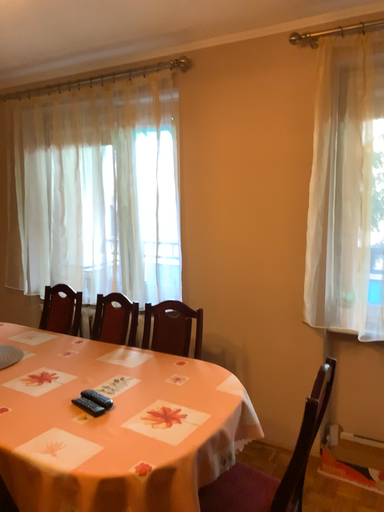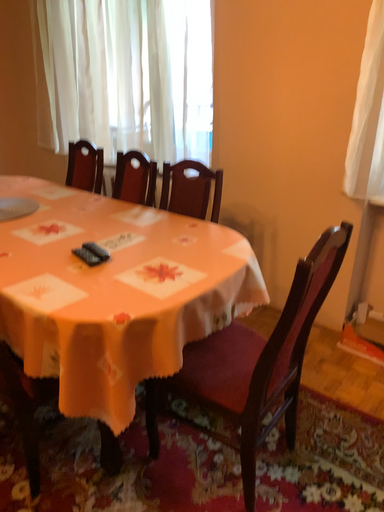
Question: How did the camera likely rotate when shooting the video?

Choices:
 (A) rotated right
 (B) rotated left

Answer: (B)